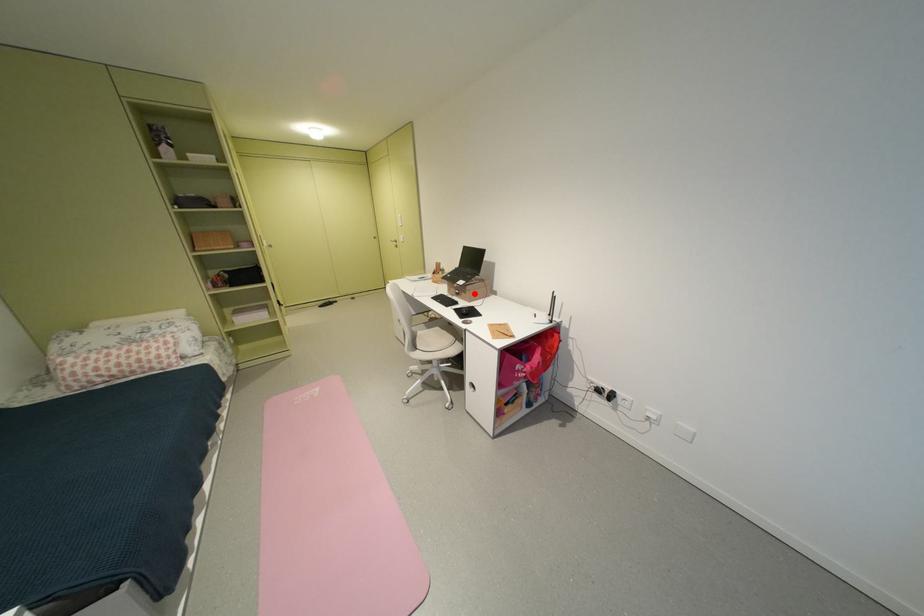
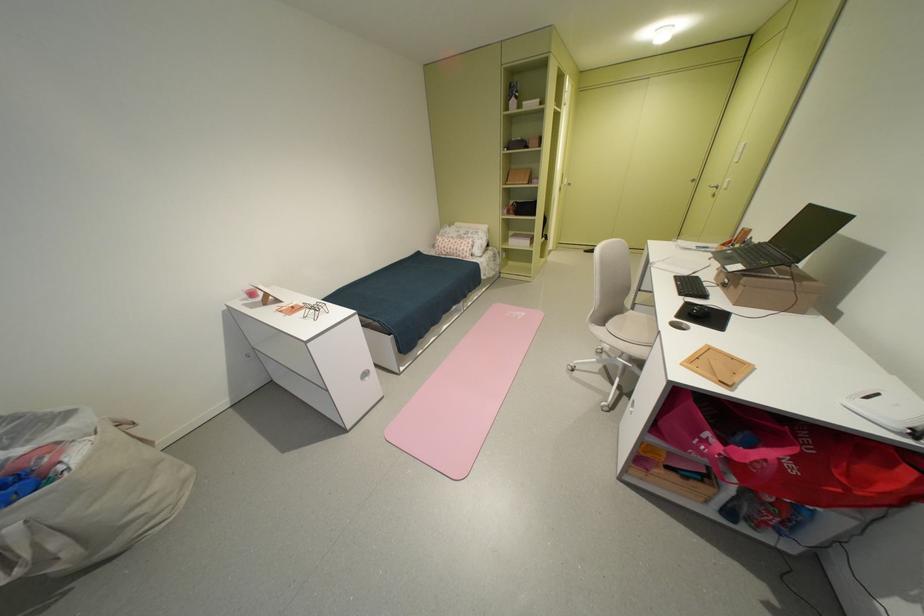
The point at the highlighted location is marked in the first image. Where is the corresponding point in the second image?

(746, 288)